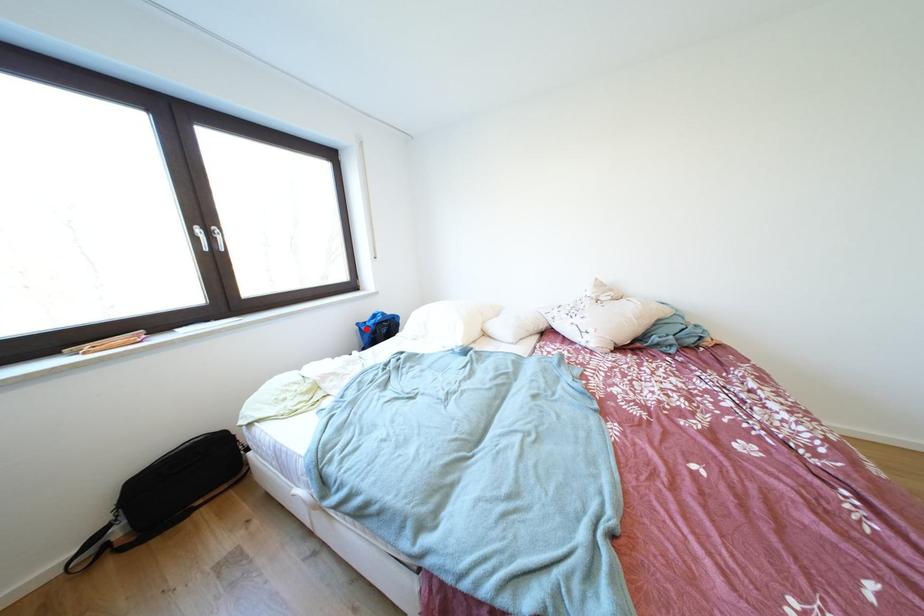
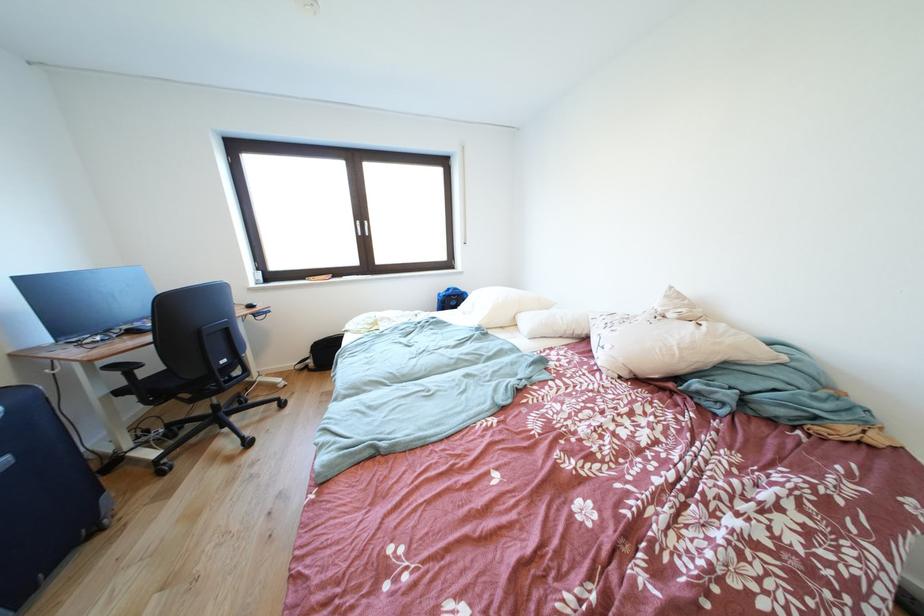
Locate, in the second image, the point that corresponds to the highlighted location in the first image.

(447, 299)